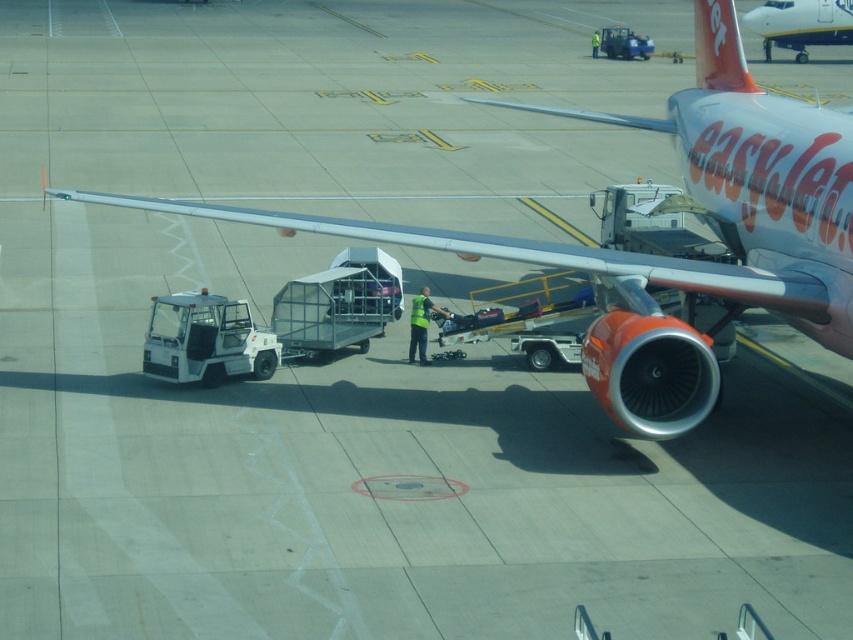
You are a ground crew member at the airport and need to locate the metallic silver airplane at center. According to the coordinates provided, where exactly is it positioned?

The metallic silver airplane at center is positioned at coordinates point (669,257).